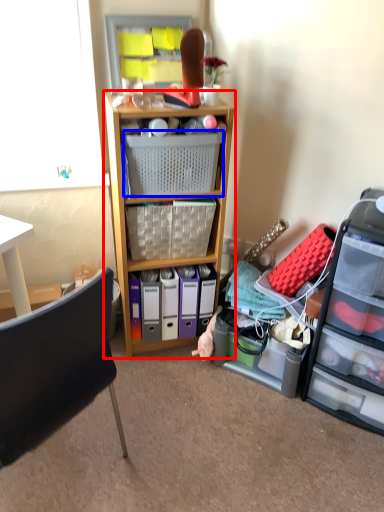
Question: Which of the following is the farthest to the observer, shelf (highlighted by a red box) or picnic basket (highlighted by a blue box)?

Choices:
 (A) shelf
 (B) picnic basket

Answer: (B)